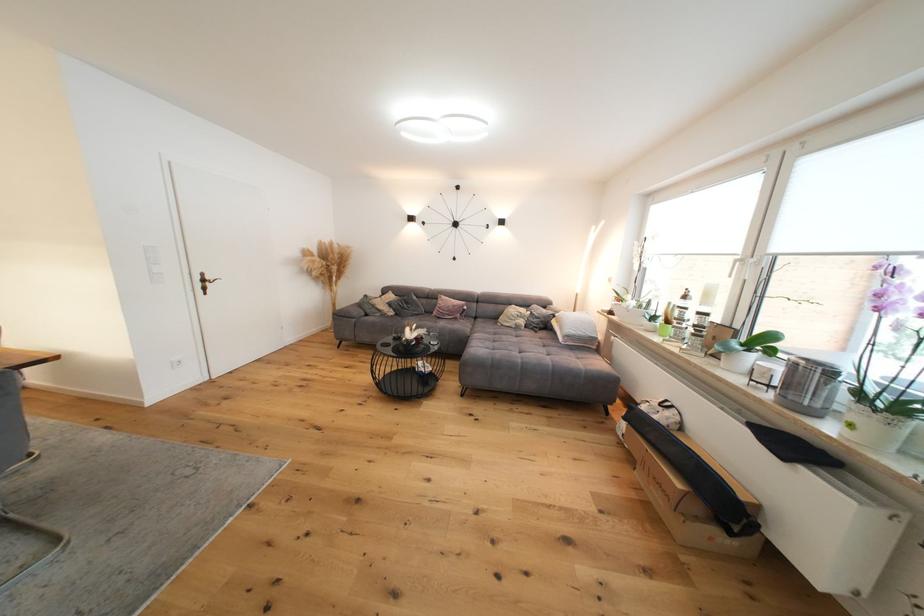
The height and width of the screenshot is (616, 924). What do you see at coordinates (205, 282) in the screenshot? I see `the dark door handle` at bounding box center [205, 282].